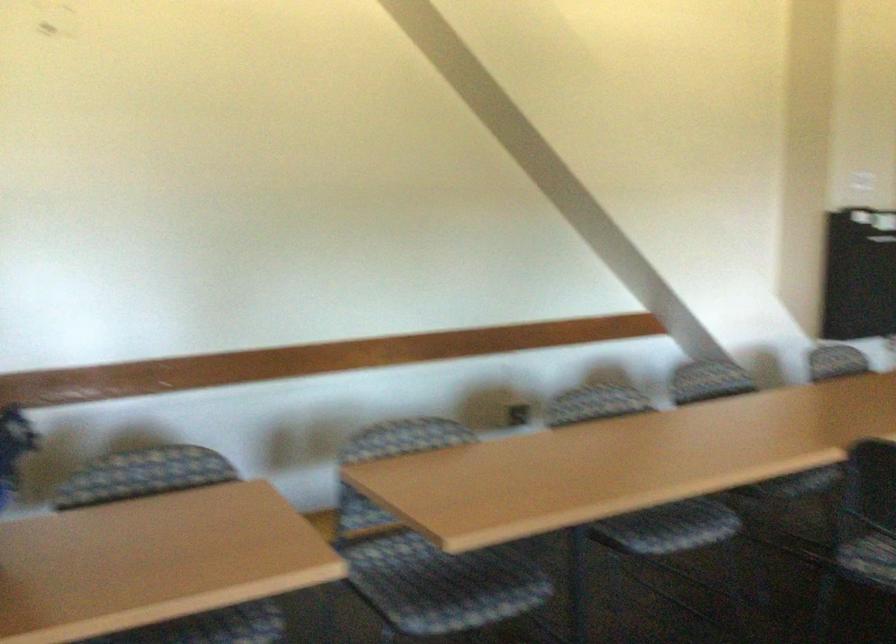
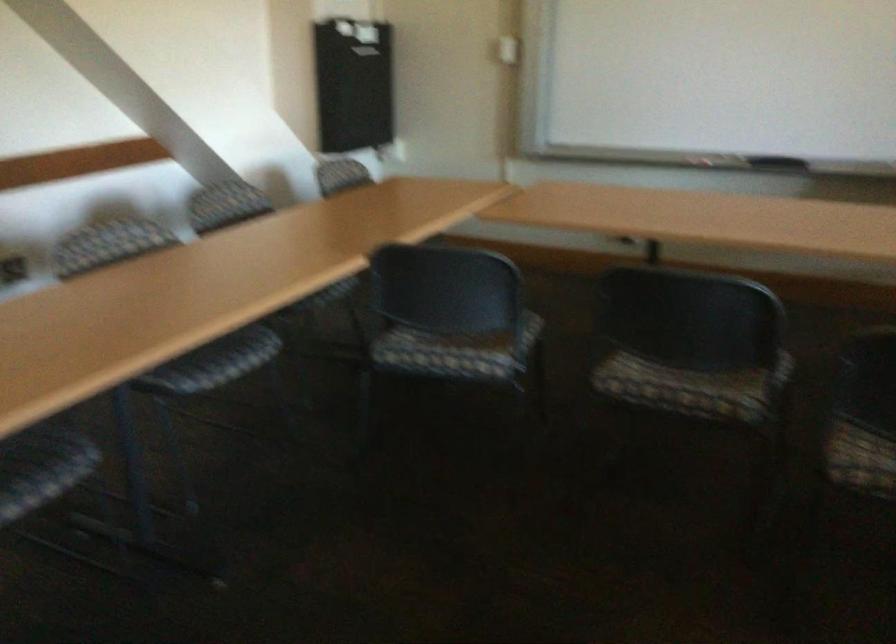
Question: The camera is either moving clockwise (left) or counter-clockwise (right) around the object. The first image is from the beginning of the video and the second image is from the end. Is the camera moving left or right when shooting the video?

Choices:
 (A) Left
 (B) Right

Answer: (A)